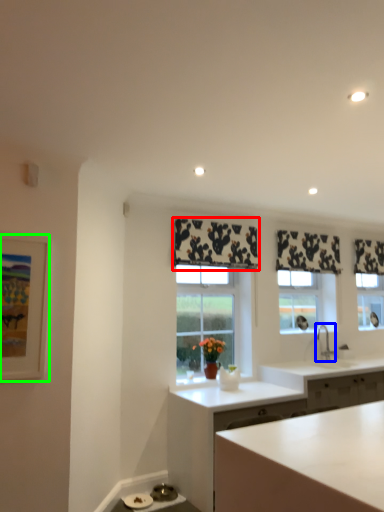
Question: Estimate the real-world distances between objects in this image. Which object is closer to curtain (highlighted by a red box), tap (highlighted by a blue box) or picture frame (highlighted by a green box)?

Choices:
 (A) tap
 (B) picture frame

Answer: (A)